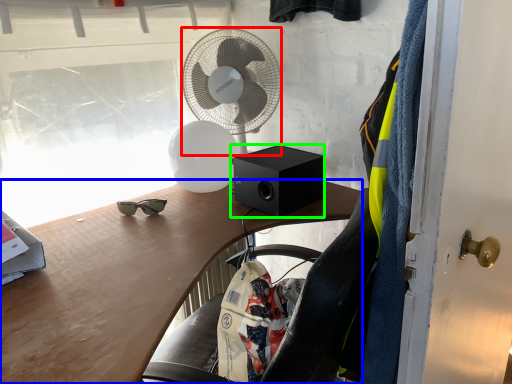
Question: Which is nearer to the mechanical fan (highlighted by a red box)? desk (highlighted by a blue box) or loudspeaker (highlighted by a green box).

Choices:
 (A) desk
 (B) loudspeaker

Answer: (B)